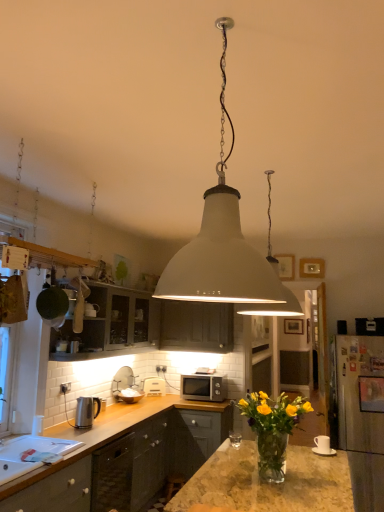
Locate an element on the screen. The height and width of the screenshot is (512, 384). blank space above white glossy sink at lower left (from a real-world perspective) is located at coordinates (34, 452).